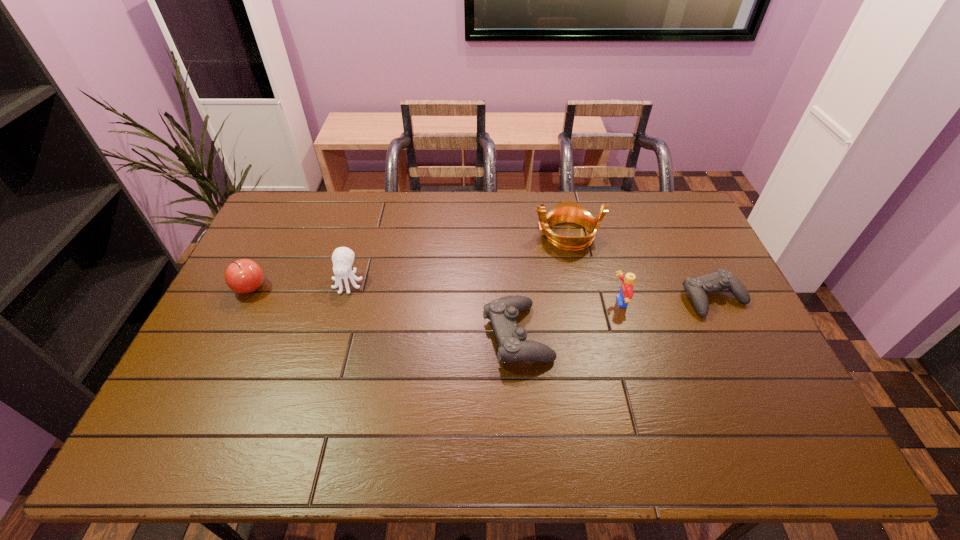
The height and width of the screenshot is (540, 960). I want to click on object that is at the right edge, so click(x=698, y=287).

This screenshot has height=540, width=960. Identify the location of vacant space at the far edge of the desktop. (436, 193).

In the image, there is a desktop. Identify the location of free region at the near edge. (630, 411).

I want to click on free point at the right edge, so click(x=700, y=240).

Where is `free area in between the second object from left to right and the right control`? This screenshot has height=540, width=960. free area in between the second object from left to right and the right control is located at coordinates (531, 291).

Image resolution: width=960 pixels, height=540 pixels. I want to click on free space between the farthest object and the Lego, so click(x=593, y=269).

Locate an element on the screen. This screenshot has width=960, height=540. free space between the second shortest object and the rightmost object is located at coordinates (615, 316).

In order to click on free space that is in between the leftmost object and the right control in this screenshot , I will do pos(482,293).

Locate an element on the screen. The height and width of the screenshot is (540, 960). empty space that is in between the left control and the tiara is located at coordinates (542, 285).

Locate an element on the screen. This screenshot has width=960, height=540. vacant point located between the fifth object from right to left and the left control is located at coordinates (433, 308).